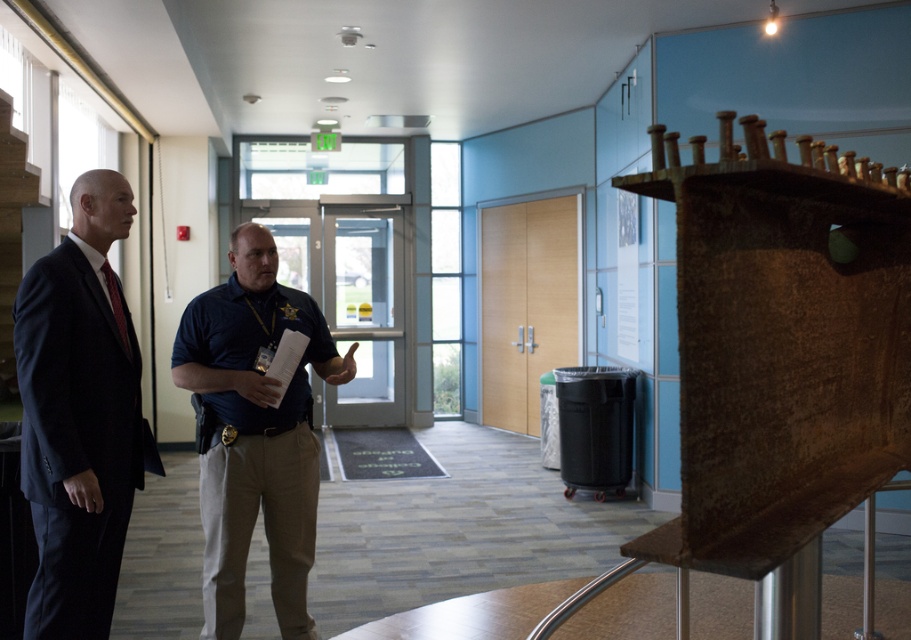
Who is more distant from viewer, (55, 490) or (219, 579)?

The point (219, 579) is more distant.

Does dark blue suit at left have a larger size compared to dark blue uniform at center?

Incorrect, dark blue suit at left is not larger than dark blue uniform at center.

Between point (123, 515) and point (326, 362), which one is positioned in front?

Point (123, 515) is more forward.

This screenshot has width=911, height=640. Find the location of `dark blue suit at left`. dark blue suit at left is located at coordinates (79, 417).

Measure the distance from dark blue uniform at center to matte black tie at left.

dark blue uniform at center and matte black tie at left are 23.44 inches apart from each other.

Which of these two, dark blue uniform at center or matte black tie at left, stands taller?

dark blue uniform at center is taller.

Identify the location of dark blue uniform at center. The height and width of the screenshot is (640, 911). (254, 433).

Can you confirm if dark blue suit at left is thinner than matte black tie at left?

No, dark blue suit at left is not thinner than matte black tie at left.

Which of these two, dark blue suit at left or matte black tie at left, stands shorter?

Standing shorter between the two is matte black tie at left.

I want to click on dark blue suit at left, so click(x=79, y=417).

Find the location of a particular element. dark blue suit at left is located at coordinates (79, 417).